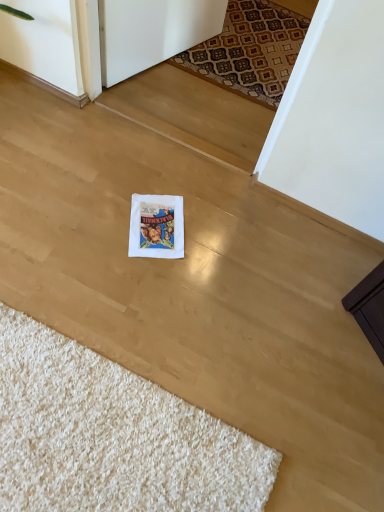
The image size is (384, 512). I want to click on unoccupied space behind white shaggy rug at lower left, so click(x=162, y=288).